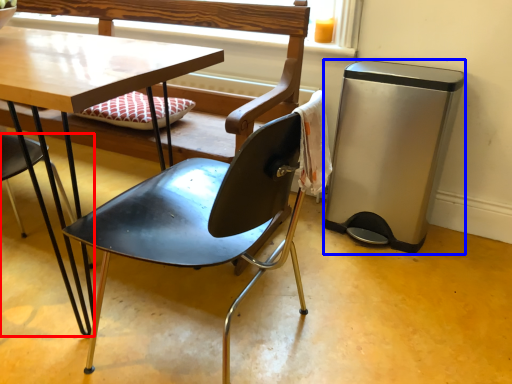
Question: Among these objects, which one is nearest to the camera, chair (highlighted by a red box) or trash bin/can (highlighted by a blue box)?

Choices:
 (A) chair
 (B) trash bin/can

Answer: (A)